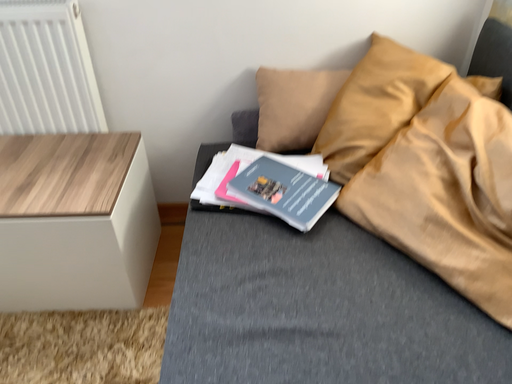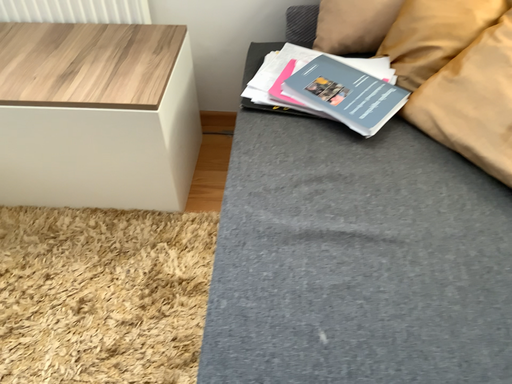
Question: Which way did the camera rotate in the video?

Choices:
 (A) rotated downward
 (B) rotated upward

Answer: (A)